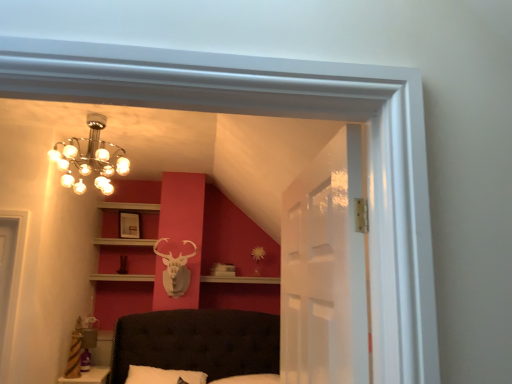
Question: Does metallic chandelier at upper left have a smaller size compared to transparent glass door at center?

Choices:
 (A) yes
 (B) no

Answer: (B)

Question: Could you tell me if metallic chandelier at upper left is turned towards transparent glass door at center?

Choices:
 (A) yes
 (B) no

Answer: (B)

Question: From the image's perspective, would you say metallic chandelier at upper left is positioned over transparent glass door at center?

Choices:
 (A) no
 (B) yes

Answer: (B)

Question: Are metallic chandelier at upper left and transparent glass door at center far apart?

Choices:
 (A) yes
 (B) no

Answer: (A)

Question: Is metallic chandelier at upper left surrounding transparent glass door at center?

Choices:
 (A) no
 (B) yes

Answer: (A)

Question: Does metallic chandelier at upper left have a larger size compared to transparent glass door at center?

Choices:
 (A) yes
 (B) no

Answer: (A)

Question: Considering the relative positions of matte white picture frame at upper center and transparent glass door at center in the image provided, is matte white picture frame at upper center in front of transparent glass door at center?

Choices:
 (A) no
 (B) yes

Answer: (A)

Question: Can you confirm if matte white picture frame at upper center is positioned to the right of transparent glass door at center?

Choices:
 (A) yes
 (B) no

Answer: (B)

Question: From the image's perspective, is matte white picture frame at upper center over transparent glass door at center?

Choices:
 (A) yes
 (B) no

Answer: (B)

Question: Is matte white picture frame at upper center bigger than transparent glass door at center?

Choices:
 (A) yes
 (B) no

Answer: (B)

Question: Is matte white picture frame at upper center at the left side of transparent glass door at center?

Choices:
 (A) yes
 (B) no

Answer: (A)

Question: Is matte white picture frame at upper center facing away from transparent glass door at center?

Choices:
 (A) no
 (B) yes

Answer: (A)

Question: Is metallic chandelier at upper left smaller than matte white picture frame at upper center?

Choices:
 (A) yes
 (B) no

Answer: (B)